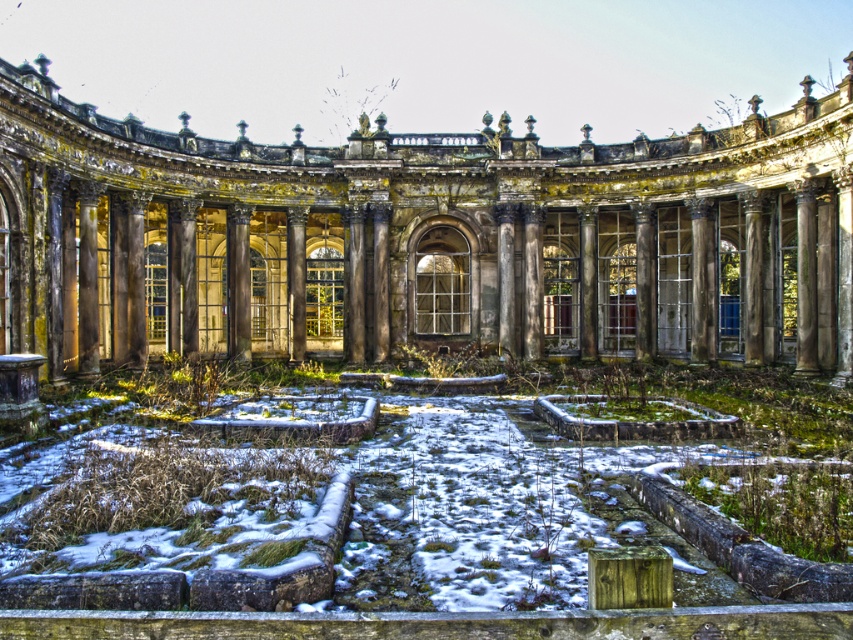
Is weathered stone palace at center to the left of white powdery snow at center from the viewer's perspective?

Incorrect, weathered stone palace at center is not on the left side of white powdery snow at center.

Is weathered stone palace at center taller than white powdery snow at center?

Yes.

Locate an element on the screen. This screenshot has height=640, width=853. weathered stone palace at center is located at coordinates (422, 237).